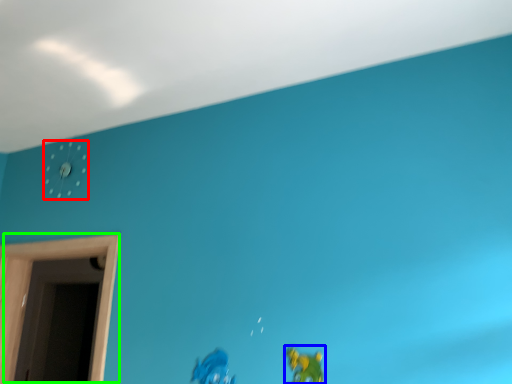
Question: Estimate the real-world distances between objects in this image. Which object is closer to clock (highlighted by a red box), toy (highlighted by a blue box) or window (highlighted by a green box)?

Choices:
 (A) toy
 (B) window

Answer: (B)